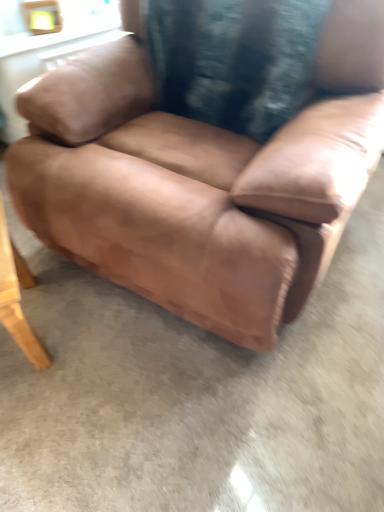
Question: Is brown leather chair at center at the right side of velvety black pillow at center?

Choices:
 (A) no
 (B) yes

Answer: (A)

Question: Is brown leather chair at center oriented away from velvety black pillow at center?

Choices:
 (A) no
 (B) yes

Answer: (B)

Question: Does brown leather chair at center appear on the left side of velvety black pillow at center?

Choices:
 (A) no
 (B) yes

Answer: (B)

Question: Does brown leather chair at center have a larger size compared to velvety black pillow at center?

Choices:
 (A) yes
 (B) no

Answer: (A)

Question: From a real-world perspective, is brown leather chair at center located higher than velvety black pillow at center?

Choices:
 (A) yes
 (B) no

Answer: (B)

Question: Are brown leather chair at center and velvety black pillow at center located far from each other?

Choices:
 (A) no
 (B) yes

Answer: (A)

Question: Is wooden table at lower left oriented away from brown leather chair at center?

Choices:
 (A) yes
 (B) no

Answer: (B)

Question: Is the depth of wooden table at lower left greater than that of brown leather chair at center?

Choices:
 (A) yes
 (B) no

Answer: (A)

Question: Are wooden table at lower left and brown leather chair at center located far from each other?

Choices:
 (A) no
 (B) yes

Answer: (A)

Question: From a real-world perspective, does wooden table at lower left stand above brown leather chair at center?

Choices:
 (A) yes
 (B) no

Answer: (B)

Question: Is wooden table at lower left surrounding brown leather chair at center?

Choices:
 (A) no
 (B) yes

Answer: (A)

Question: From the image's perspective, is wooden table at lower left under brown leather chair at center?

Choices:
 (A) no
 (B) yes

Answer: (B)

Question: Is velvety black pillow at center positioned behind brown leather chair at center?

Choices:
 (A) no
 (B) yes

Answer: (B)